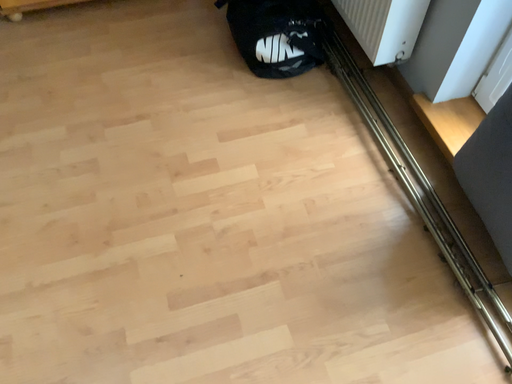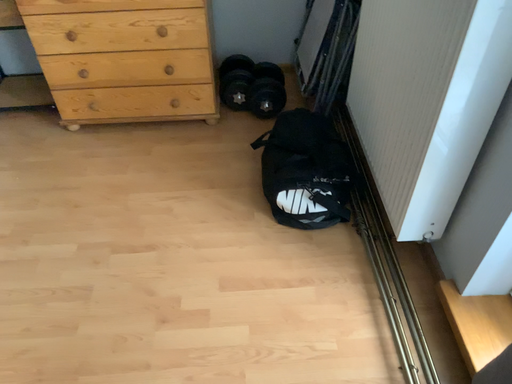
Question: Which way did the camera rotate in the video?

Choices:
 (A) rotated upward
 (B) rotated downward

Answer: (A)